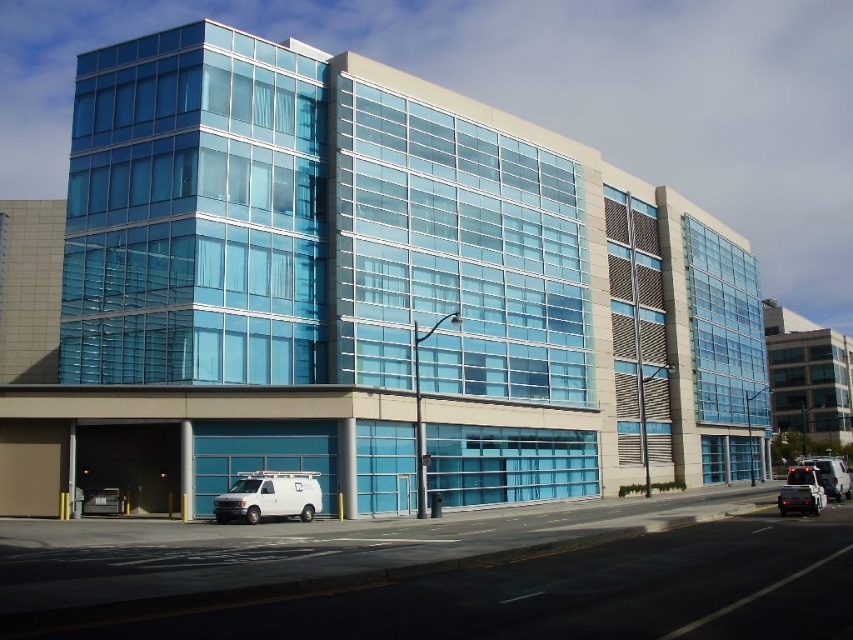
What do you see at coordinates (801, 492) in the screenshot? The width and height of the screenshot is (853, 640). I see `shiny black car at lower right` at bounding box center [801, 492].

This screenshot has height=640, width=853. Identify the location of shiny black car at lower right. (801, 492).

Measure the distance between white matte van at lower center and shiny black car at lower right.

white matte van at lower center is 17.68 meters away from shiny black car at lower right.

Which of these two, white matte van at lower center or shiny black car at lower right, stands shorter?

white matte van at lower center

The image size is (853, 640). Describe the element at coordinates (270, 497) in the screenshot. I see `white matte van at lower center` at that location.

At what (x,y) coordinates should I click in order to perform the action: click on white matte van at lower center. Please return your answer as a coordinate pair (x, y). Looking at the image, I should click on (270, 497).

Which is more to the left, white matte van at lower center or metallic silver car at lower right?

white matte van at lower center

Looking at this image, is white matte van at lower center smaller than metallic silver car at lower right?

No, white matte van at lower center is not smaller than metallic silver car at lower right.

Between point (260, 499) and point (808, 490), which one is positioned in front?

Point (808, 490) is more forward.

I want to click on white matte van at lower center, so click(270, 497).